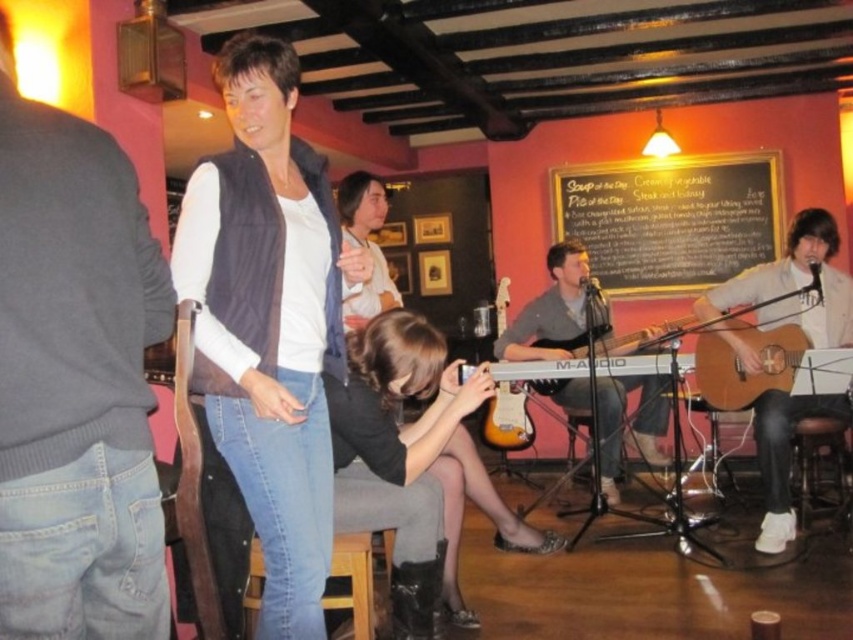
Question: Which is farther from the smooth brown hair at center?

Choices:
 (A) matte blue vest at center
 (B) acoustic wood guitar at center
 (C) wooden acoustic guitar at center

Answer: (C)

Question: Is black leather boots at lower center further to the viewer compared to acoustic wood guitar at center?

Choices:
 (A) yes
 (B) no

Answer: (B)

Question: Does black chalkboard at upper center have a greater width compared to light brown acoustic guitar at right?

Choices:
 (A) no
 (B) yes

Answer: (B)

Question: Which object is the closest to the wooden acoustic guitar at center?

Choices:
 (A) light brown acoustic guitar at right
 (B) smooth brown hair at center
 (C) denim fabric bar stool at lower center

Answer: (A)

Question: Which is farther from the light brown acoustic guitar at right?

Choices:
 (A) wooden bar stool at lower right
 (B) smooth brown hair at center
 (C) denim fabric bar stool at lower center
 (D) gray cotton sweater at left

Answer: (D)

Question: Where is gray cotton sweater at left located in relation to acoustic wood guitar at center in the image?

Choices:
 (A) above
 (B) below

Answer: (A)